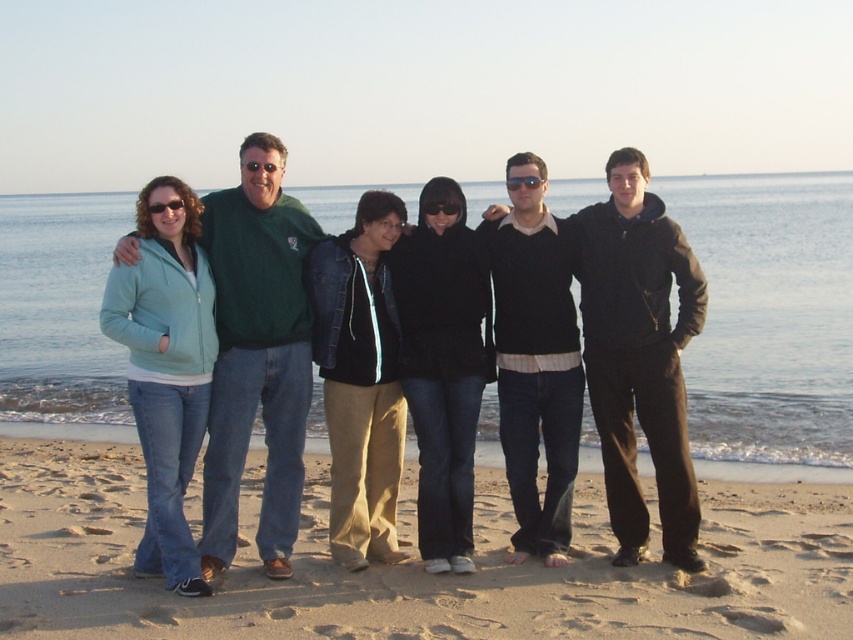
Question: Can you confirm if sandy brown sand at lower center is positioned above green sweater at center?

Choices:
 (A) no
 (B) yes

Answer: (A)

Question: Does matte green sweater at center have a larger size compared to dark brown sweater at center?

Choices:
 (A) no
 (B) yes

Answer: (B)

Question: Which object appears closest to the camera in this image?

Choices:
 (A) sandy brown sand at lower center
 (B) green sweater at center
 (C) dark brown sweater at center

Answer: (A)

Question: Which object is positioned farthest from the sandy brown sand at lower center?

Choices:
 (A) matte green sweater at center
 (B) dark brown sweater at center

Answer: (B)

Question: Which point is farther to the camera?

Choices:
 (A) (582, 272)
 (B) (218, 417)
 (C) (599, 346)

Answer: (A)

Question: Does sandy brown sand at lower center have a lesser width compared to dark brown sweater at center?

Choices:
 (A) yes
 (B) no

Answer: (A)